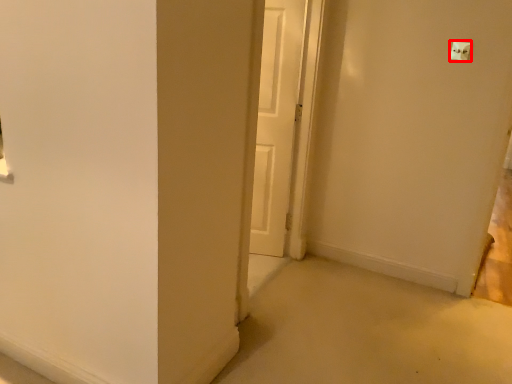
Question: From the image's perspective, where is light switch (annotated by the red box) located in relation to door in the image?

Choices:
 (A) below
 (B) above

Answer: (B)